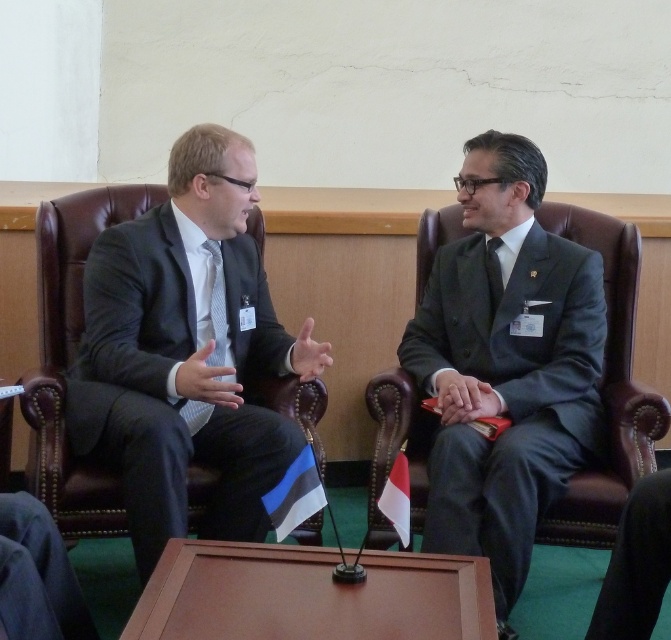
Question: Can you confirm if matte black suit at left is positioned above black silk tie at center?

Choices:
 (A) no
 (B) yes

Answer: (A)

Question: Does blue and white striped flag at lower center have a larger size compared to striped fabric tie at left?

Choices:
 (A) no
 (B) yes

Answer: (A)

Question: Considering the real-world distances, which object is farthest from the black silk tie at center?

Choices:
 (A) striped fabric tie at left
 (B) matte black suit at left
 (C) gray matte suit at right

Answer: (B)

Question: Which of the following is the farthest from the observer?

Choices:
 (A) black silk tie at center
 (B) matte black suit at left
 (C) gray matte suit at right
 (D) striped fabric tie at left

Answer: (A)

Question: Is matte black suit at left to the left of striped fabric tie at left from the viewer's perspective?

Choices:
 (A) yes
 (B) no

Answer: (A)

Question: Considering the real-world distances, which object is farthest from the blue and white striped flag at lower center?

Choices:
 (A) black silk tie at center
 (B) matte black suit at left
 (C) striped fabric tie at left

Answer: (A)